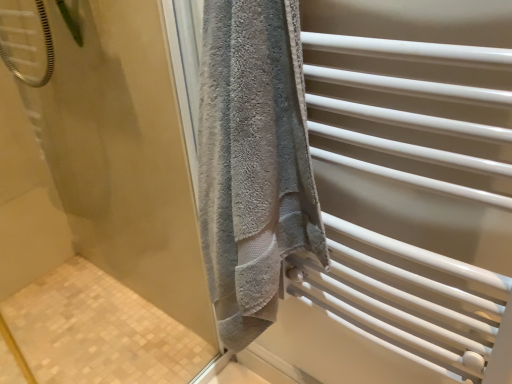
Question: Would you say gray towel at upper right, placed as the second screen door when sorted from right to left, is to the left or to the right of gray towel at right, the 1th screen door from the right, in the picture?

Choices:
 (A) left
 (B) right

Answer: (A)

Question: From a real-world perspective, is gray towel at upper right, placed as the second screen door when sorted from right to left, physically located above or below gray towel at right, the 1th screen door from the right?

Choices:
 (A) above
 (B) below

Answer: (B)

Question: Is point (111, 87) closer or farther from the camera than point (409, 48)?

Choices:
 (A) farther
 (B) closer

Answer: (A)

Question: From a real-world perspective, is gray towel at right, the 1th screen door from the right, physically located above or below gray towel at upper right, the 1th screen door in the left-to-right sequence?

Choices:
 (A) below
 (B) above

Answer: (B)

Question: Visually, is gray towel at right, which is the 2th screen door in left-to-right order, positioned to the left or to the right of gray towel at upper right, placed as the second screen door when sorted from right to left?

Choices:
 (A) left
 (B) right

Answer: (B)

Question: Considering the positions of gray towel at right, which is the 2th screen door in left-to-right order, and gray towel at upper right, the 1th screen door in the left-to-right sequence, in the image, is gray towel at right, which is the 2th screen door in left-to-right order, bigger or smaller than gray towel at upper right, the 1th screen door in the left-to-right sequence,?

Choices:
 (A) small
 (B) big

Answer: (A)

Question: Is gray towel at right, the 1th screen door from the right, in front of or behind gray towel at upper right, the 1th screen door in the left-to-right sequence, in the image?

Choices:
 (A) behind
 (B) front

Answer: (A)